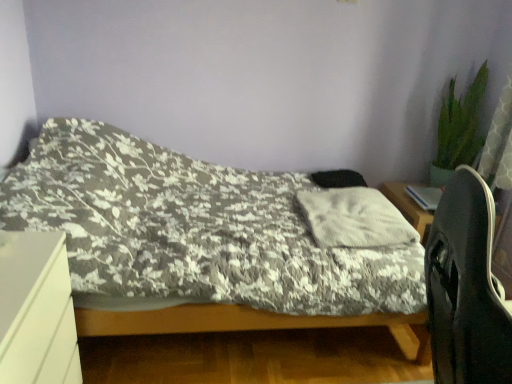
Question: Is fluffy gray blanket at center inside or outside of green leafy plant at upper right?

Choices:
 (A) inside
 (B) outside

Answer: (B)

Question: Considering the positions of fluffy gray blanket at center and green leafy plant at upper right in the image, is fluffy gray blanket at center bigger or smaller than green leafy plant at upper right?

Choices:
 (A) big
 (B) small

Answer: (A)

Question: Based on their relative distances, which object is nearer to the green leafy plant at upper right?

Choices:
 (A) fluffy white pillow at center
 (B) fluffy gray blanket at center
 (C) black matte computer chair at right
 (D) white matte desk at lower left

Answer: (A)

Question: Which is nearer to the fluffy gray blanket at center?

Choices:
 (A) white matte desk at lower left
 (B) black matte computer chair at right
 (C) fluffy white pillow at center
 (D) green leafy plant at upper right

Answer: (C)